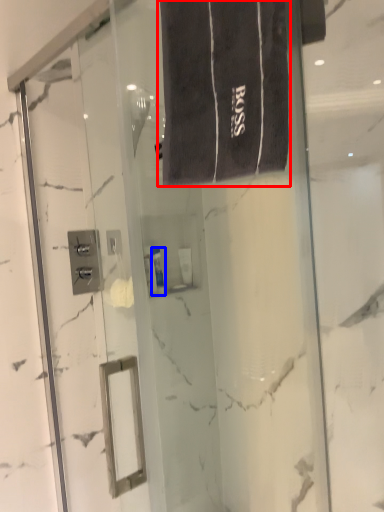
Question: Which of the following is the farthest to the observer, bath towel (highlighted by a red box) or toiletry (highlighted by a blue box)?

Choices:
 (A) bath towel
 (B) toiletry

Answer: (B)